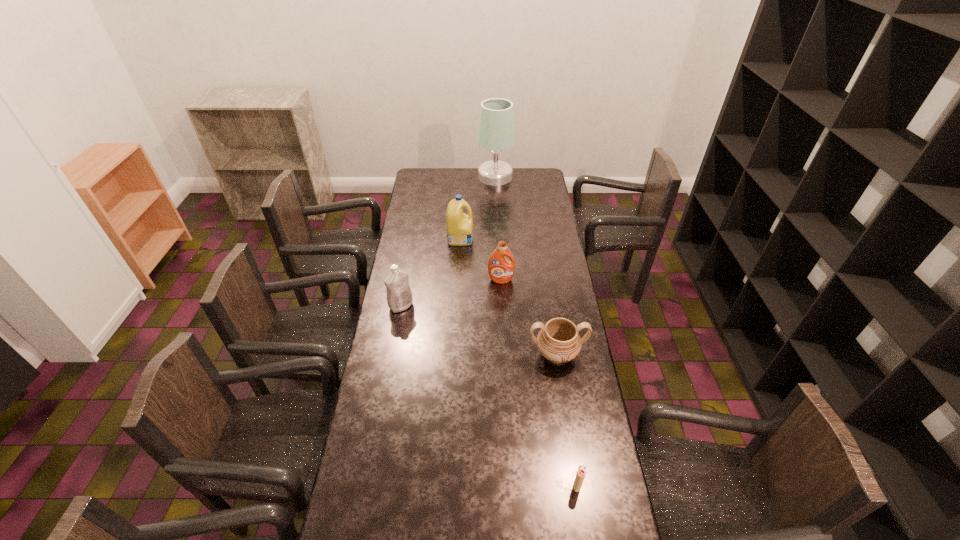
Locate an element on the screen. the farthest object is located at coordinates (496, 133).

The image size is (960, 540). In order to click on the tallest object in this screenshot , I will do `click(496, 133)`.

The image size is (960, 540). Find the location of `the second object from left to right`. the second object from left to right is located at coordinates (459, 225).

Image resolution: width=960 pixels, height=540 pixels. What are the coordinates of `the fifth nearest object` in the screenshot? It's located at (459, 225).

The width and height of the screenshot is (960, 540). Find the location of `the second farthest detergent`. the second farthest detergent is located at coordinates (501, 270).

I want to click on the fourth nearest object, so click(x=501, y=270).

At what (x,y) coordinates should I click in order to perform the action: click on the nearest detergent. Please return your answer as a coordinate pair (x, y). Looking at the image, I should click on (399, 295).

Identify the location of the third nearest object. This screenshot has width=960, height=540. (399, 295).

Image resolution: width=960 pixels, height=540 pixels. Identify the location of urn. (558, 341).

At what (x,y) coordinates should I click in order to perform the action: click on the second nearest object. Please return your answer as a coordinate pair (x, y). This screenshot has height=540, width=960. Looking at the image, I should click on (558, 341).